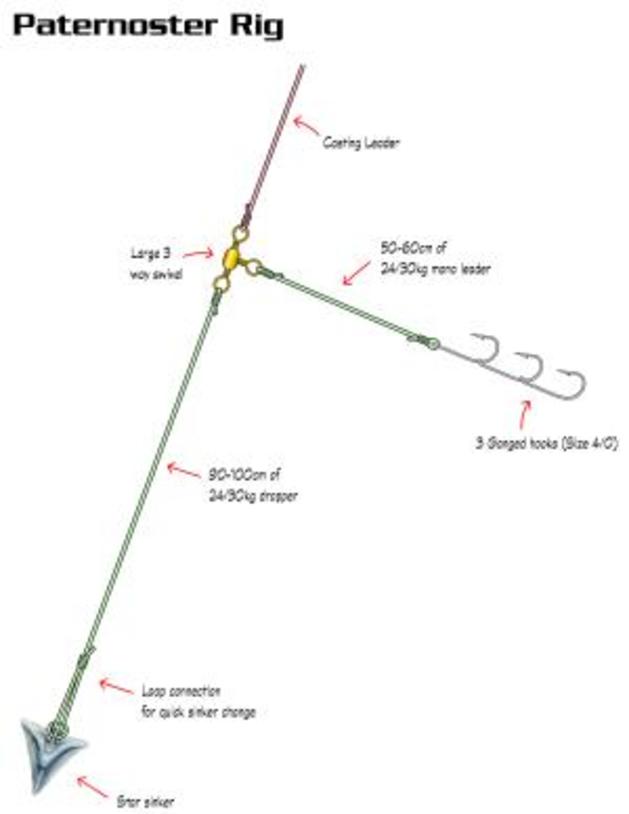
Where is `hooks`? The height and width of the screenshot is (814, 629). hooks is located at coordinates (490, 352), (526, 357), (576, 374).